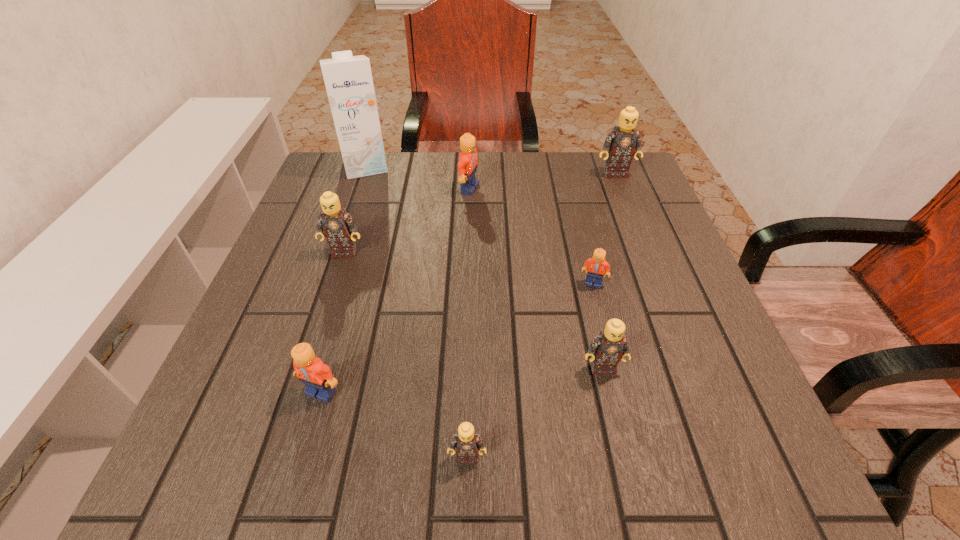
Find the location of `carton`. carton is located at coordinates (348, 79).

This screenshot has height=540, width=960. In order to click on the farthest Lego in this screenshot , I will do `click(621, 143)`.

The height and width of the screenshot is (540, 960). What are the coordinates of `the farthest tan Lego` in the screenshot? It's located at (621, 143).

Identify the location of the biggest orange Lego. [x=467, y=166].

Where is `the second orange Lego from right to left`? This screenshot has width=960, height=540. the second orange Lego from right to left is located at coordinates (467, 166).

Find the location of a particular element. Image resolution: width=960 pixels, height=540 pixels. the second farthest tan Lego is located at coordinates (338, 226).

Identify the location of the second biggest tan Lego. The height and width of the screenshot is (540, 960). (338, 226).

Where is `the second nearest Lego`? Image resolution: width=960 pixels, height=540 pixels. the second nearest Lego is located at coordinates (317, 377).

Where is `the second nearest object`? the second nearest object is located at coordinates (317, 377).

Where is `the third tan Lego from left to right`? This screenshot has width=960, height=540. the third tan Lego from left to right is located at coordinates (607, 349).